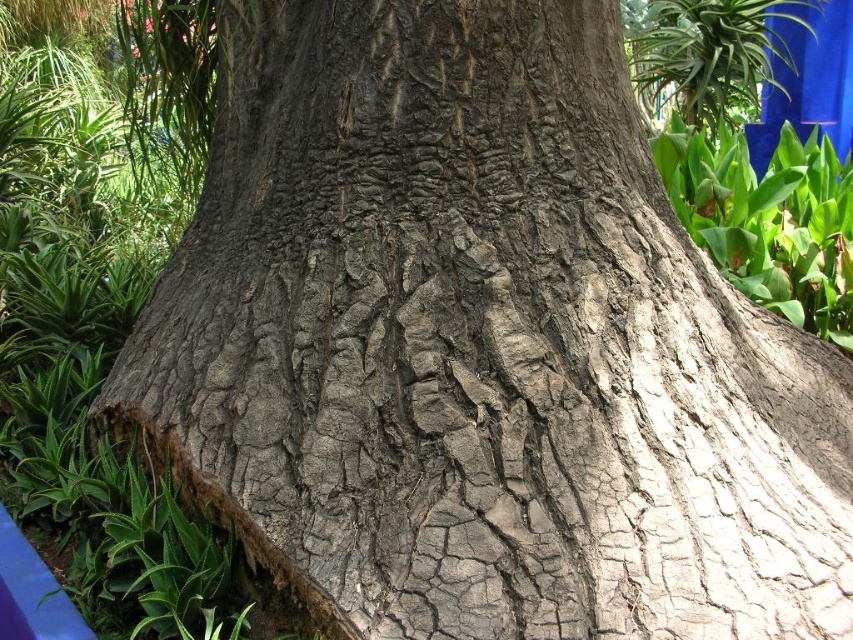
Measure the distance between green leafy plant at right and green leafy plant at upper right.

They are 29.00 inches apart.

Between point (724, 257) and point (780, 45), which one is positioned behind?

The point (780, 45) is behind.

Does point (798, 285) come farther from viewer compared to point (627, 4)?

No.

What are the coordinates of `green leafy plant at right` in the screenshot? It's located at (769, 220).